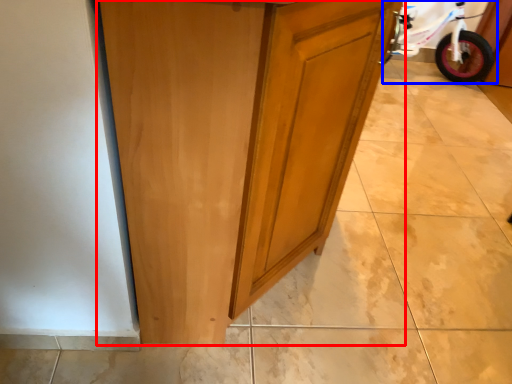
Question: Which object is further to the camera taking this photo, cupboard (highlighted by a red box) or bicycle (highlighted by a blue box)?

Choices:
 (A) cupboard
 (B) bicycle

Answer: (B)